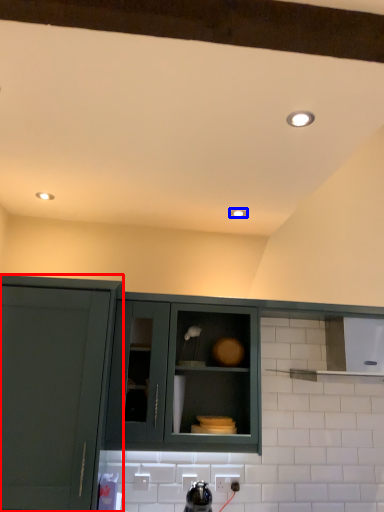
Question: Among these objects, which one is farthest to the camera, cabinetry (highlighted by a red box) or lighting (highlighted by a blue box)?

Choices:
 (A) cabinetry
 (B) lighting

Answer: (B)